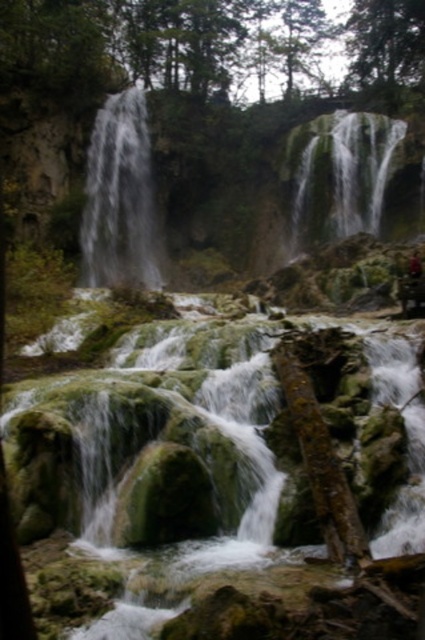
Based on the photo, is white frothy water at left thinner than camouflage fabric hiker at center?

No, white frothy water at left is not thinner than camouflage fabric hiker at center.

The height and width of the screenshot is (640, 425). In order to click on white frothy water at left in this screenshot , I will do `click(119, 198)`.

Locate an element on the screen. The height and width of the screenshot is (640, 425). white frothy water at left is located at coordinates tap(119, 198).

Between white frothy water at left and green mossy rock at upper right, which one appears on the left side from the viewer's perspective?

white frothy water at left

Who is positioned more to the right, white frothy water at left or green mossy rock at upper right?

green mossy rock at upper right

This screenshot has width=425, height=640. What do you see at coordinates (119, 198) in the screenshot?
I see `white frothy water at left` at bounding box center [119, 198].

The image size is (425, 640). What are the coordinates of `white frothy water at left` in the screenshot? It's located at coord(119,198).

Between green mossy rock at upper right and camouflage fabric hiker at center, which one is positioned lower?

Positioned lower is camouflage fabric hiker at center.

Locate an element on the screen. The image size is (425, 640). green mossy rock at upper right is located at coordinates (342, 176).